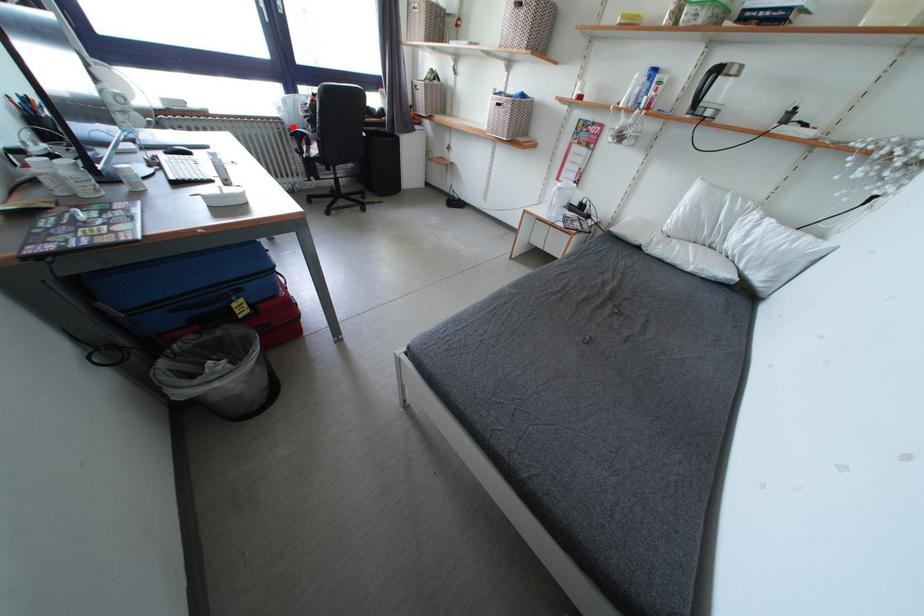
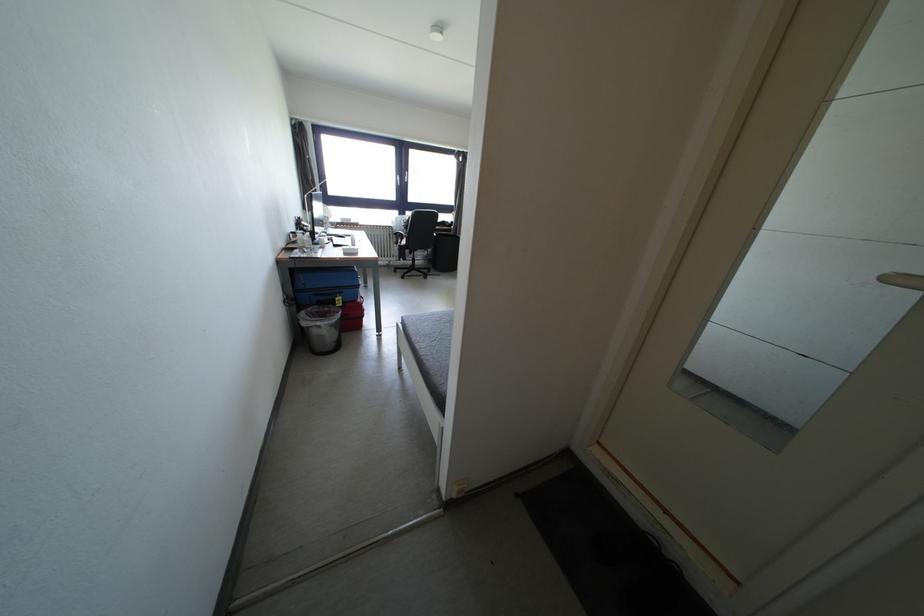
Locate, in the second image, the point that corresponds to the highlighted location in the first image.

(400, 233)